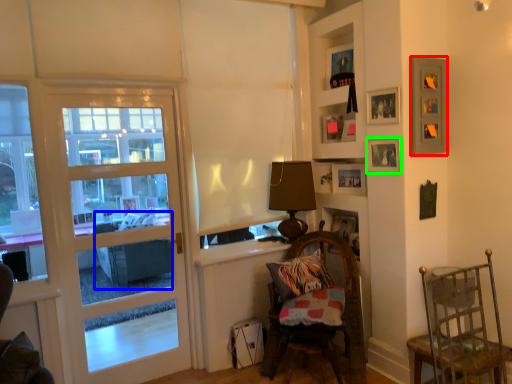
Question: Estimate the real-world distances between objects in this image. Which object is closer to picture frame (highlighted by a red box), studio couch (highlighted by a blue box) or picture frame (highlighted by a green box)?

Choices:
 (A) studio couch
 (B) picture frame

Answer: (B)